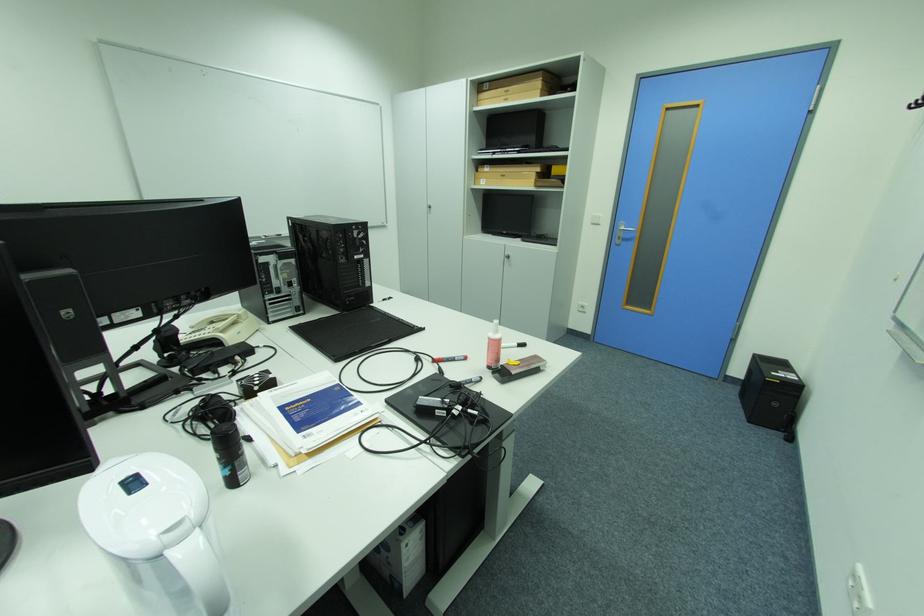
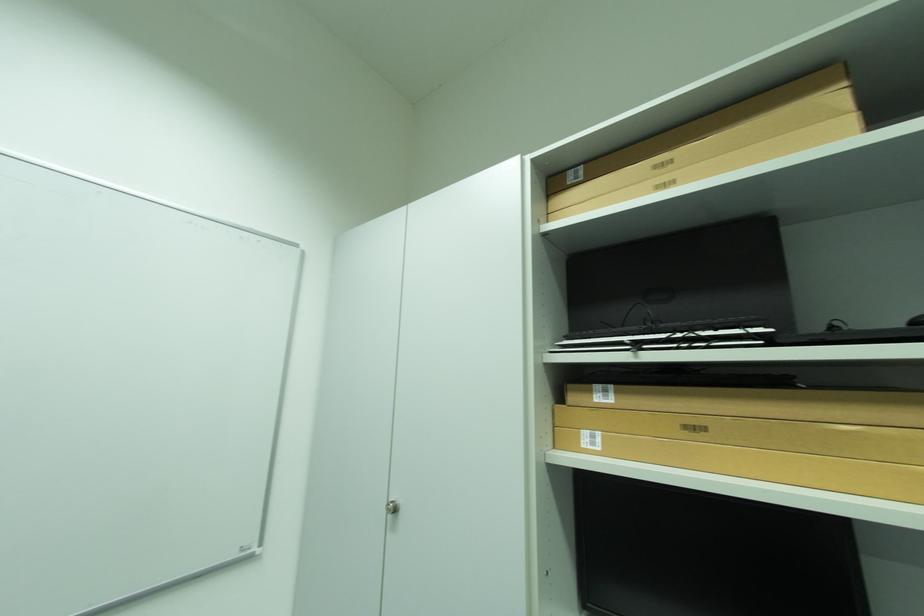
The point at (494, 168) is marked in the first image. Where is the corresponding point in the second image?

(614, 392)